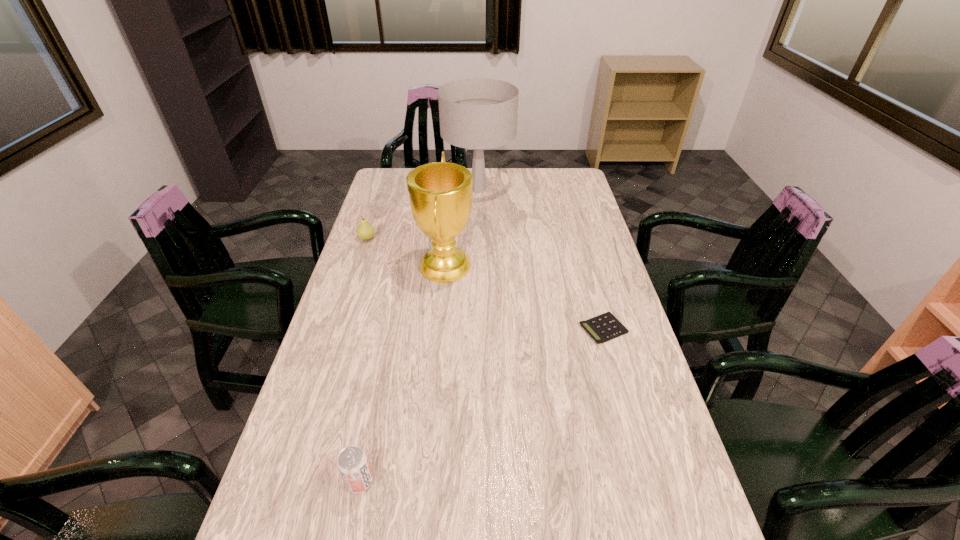
Locate an element on the screen. The image size is (960, 540). the farthest object is located at coordinates (476, 113).

Identify the location of lampshade. The width and height of the screenshot is (960, 540). (476, 113).

The height and width of the screenshot is (540, 960). Find the location of `award`. award is located at coordinates (440, 193).

Where is `soda can`? This screenshot has height=540, width=960. soda can is located at coordinates (353, 465).

This screenshot has height=540, width=960. In order to click on the fourth object from right to left in this screenshot , I will do `click(353, 465)`.

Where is `pear`? The height and width of the screenshot is (540, 960). pear is located at coordinates (365, 231).

Where is `the second nearest object`? the second nearest object is located at coordinates (602, 328).

Locate an element on the screen. The height and width of the screenshot is (540, 960). the rightmost object is located at coordinates (602, 328).

This screenshot has height=540, width=960. I want to click on vacant position located 0.240m on the front-facing side of the tallest object, so click(x=568, y=190).

Locate an element on the screen. This screenshot has height=540, width=960. free space located 0.400m on the shiny surface of the fourth shortest object is located at coordinates (589, 265).